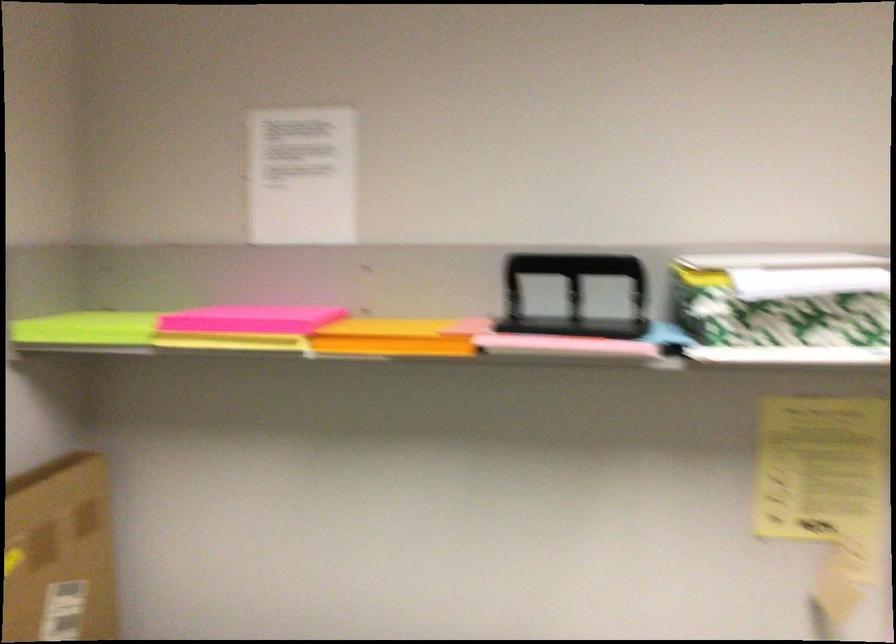
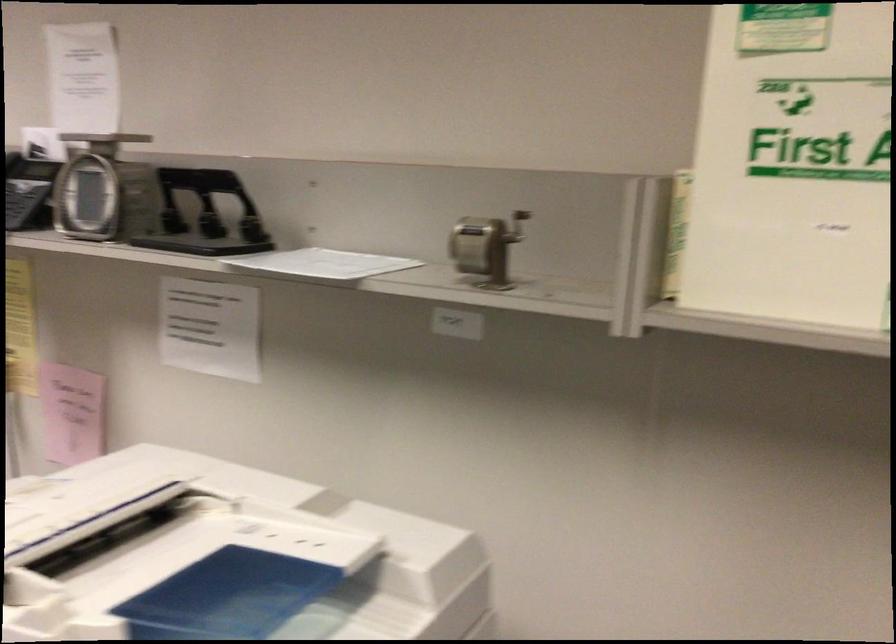
How did the camera likely rotate?

The rotation direction of the camera is right-down.